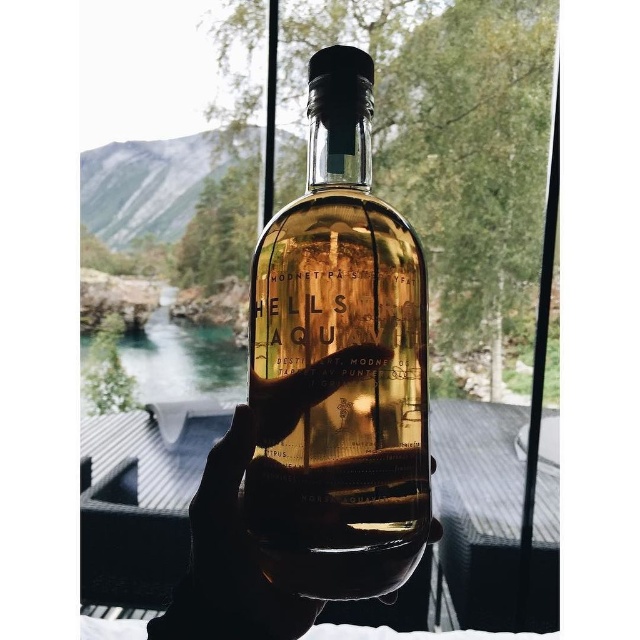
Is translucent amber glass bottle at center above translucent glass bottle at center?

Correct, translucent amber glass bottle at center is located above translucent glass bottle at center.

Does translucent amber glass bottle at center have a lesser width compared to translucent glass bottle at center?

Yes, translucent amber glass bottle at center is thinner than translucent glass bottle at center.

Who is more forward, (390, 326) or (211, 513)?

Point (211, 513)

Where is `translucent amber glass bottle at center`? This screenshot has height=640, width=640. translucent amber glass bottle at center is located at coordinates (339, 364).